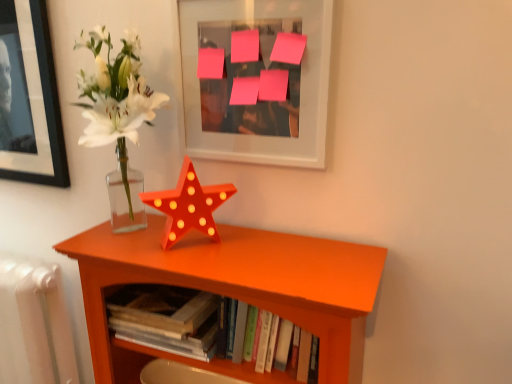
Where is `free point to the right of matte glass vase at center left`? The image size is (512, 384). free point to the right of matte glass vase at center left is located at coordinates (259, 258).